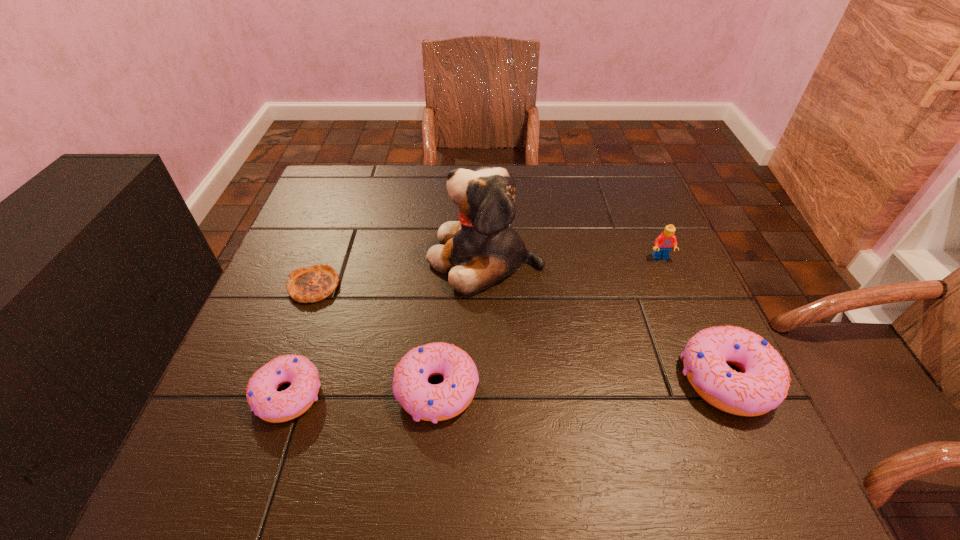
Locate an element on the screen. The image size is (960, 540). free location that satisfies the following two spatial constraints: 1. at the face of the rightmost doughnut; 2. on the left side of the puppy is located at coordinates (487, 379).

The image size is (960, 540). Find the location of `free spot that satisfies the following two spatial constraints: 1. at the face of the tallest object; 2. on the right side of the rightmost doughnut`. free spot that satisfies the following two spatial constraints: 1. at the face of the tallest object; 2. on the right side of the rightmost doughnut is located at coordinates [x=487, y=379].

Where is `free space in the image that satisfies the following two spatial constraints: 1. at the face of the tallest object; 2. on the front side of the quiche`? The height and width of the screenshot is (540, 960). free space in the image that satisfies the following two spatial constraints: 1. at the face of the tallest object; 2. on the front side of the quiche is located at coordinates (486, 286).